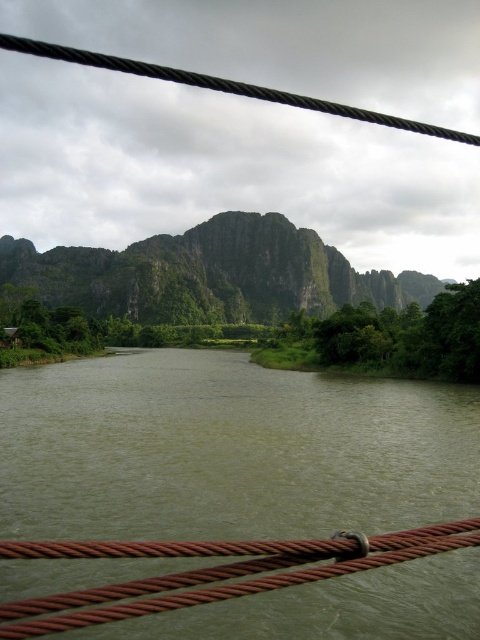
You are standing at the point marked as point (228, 451) in the image. What do you see directly in front of you?

You see green murky water at center directly in front of you.

You are standing at the edge of the valley and want to cross the river using a small boat. The boat can only carry a maximum weight of 100 kg. The green rocky mountain at center has a large boulder that weighs 120 kg. Can you safely transport the boulder across the green murky water at center in one trip?

The green rocky mountain at center has a large boulder that weighs 120 kg, which exceeds the boat capacity of 100 kg. Therefore, you cannot safely transport the boulder across the green murky water at center in one trip.

In the scene shown: You are planning to cross the river using a small boat. The boat can only carry items that are smaller than the green rocky mountain at center. Can the boat carry the green murky water at center?

The green murky water at center is smaller than the green rocky mountain at center, so yes, the boat can carry the green murky water at center since it is smaller than the mountain.